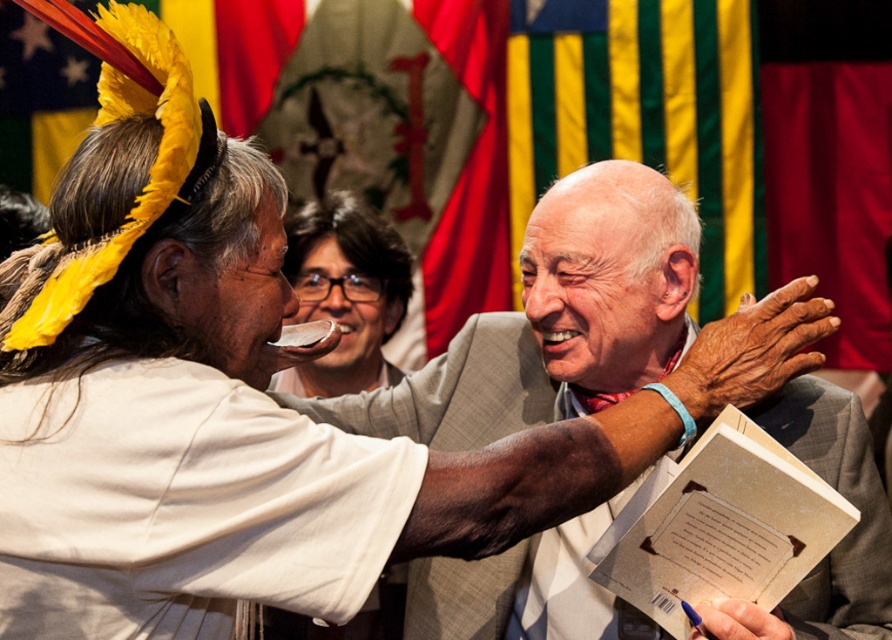
Question: Is light gray suit at center positioned at the back of beige paper book at lower right?

Choices:
 (A) yes
 (B) no

Answer: (A)

Question: Estimate the real-world distances between objects in this image. Which object is farther from the silky fabric flag at upper center?

Choices:
 (A) light gray suit at center
 (B) matte black glasses at center
 (C) beige paper book at lower right

Answer: (C)

Question: Can you confirm if silky fabric flag at upper center is bigger than beige paper book at lower right?

Choices:
 (A) no
 (B) yes

Answer: (B)

Question: Which object is positioned farthest from the beige paper book at lower right?

Choices:
 (A) matte black glasses at center
 (B) silky fabric flag at upper center
 (C) light gray suit at center

Answer: (B)

Question: Which point is farther to the camera?

Choices:
 (A) (310, 300)
 (B) (770, 481)
 (C) (393, 141)

Answer: (C)

Question: Can you confirm if light gray suit at center is positioned to the right of matte black glasses at center?

Choices:
 (A) no
 (B) yes

Answer: (B)